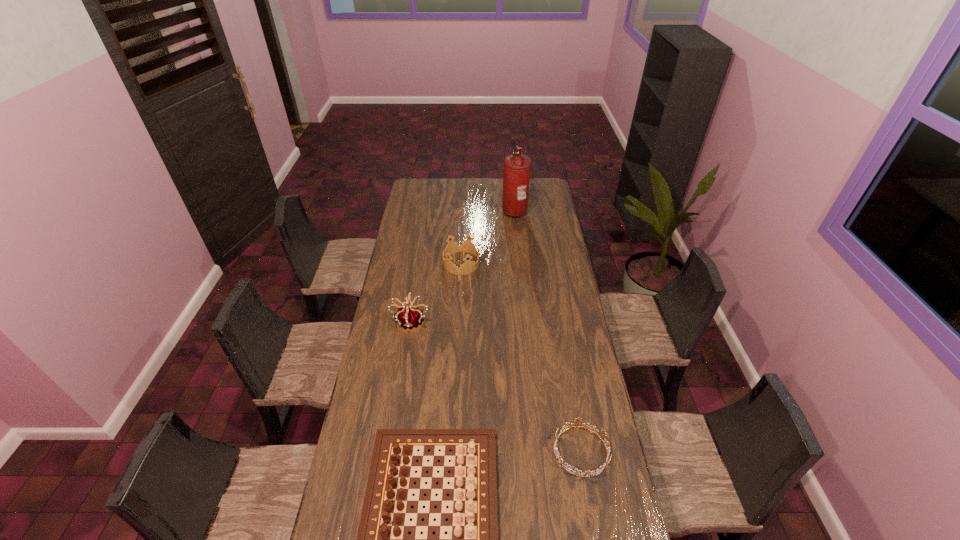
Identify the location of vacant space situated 0.140m at the front of the farthest object where the nozzle is aimed. (479, 210).

Image resolution: width=960 pixels, height=540 pixels. I want to click on free spot located 0.190m on the front-facing side of the fourth shortest object, so click(402, 371).

At what (x,y) coordinates should I click in order to perform the action: click on free space located 0.170m on the front-facing side of the second farthest object. Please return your answer as a coordinate pair (x, y). The width and height of the screenshot is (960, 540). Looking at the image, I should click on (512, 263).

This screenshot has height=540, width=960. Find the location of `free point located on the front-facing side of the shortest tiara`. free point located on the front-facing side of the shortest tiara is located at coordinates coord(590,502).

Locate an element on the screen. object that is at the left edge is located at coordinates (x=410, y=318).

The height and width of the screenshot is (540, 960). What are the coordinates of `object present at the right edge` in the screenshot? It's located at (578, 419).

This screenshot has height=540, width=960. Find the location of `vacant space at the far edge`. vacant space at the far edge is located at coordinates (437, 186).

Find the location of `free space at the left edge of the desktop`. free space at the left edge of the desktop is located at coordinates (354, 462).

Locate an element on the screen. The image size is (960, 540). free point at the right edge is located at coordinates (565, 295).

The image size is (960, 540). Identify the location of vacant space at the far right corner of the desktop. (531, 191).